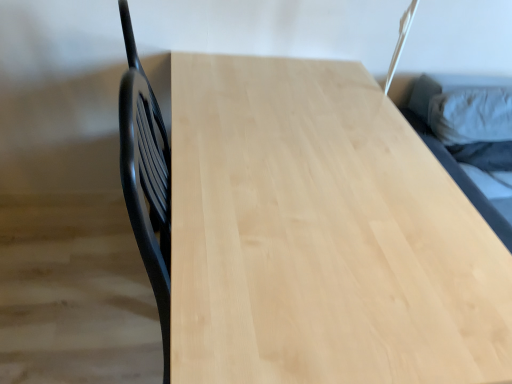
Where is `blank space situated above light wood table at center (from a real-world perspective)`? This screenshot has height=384, width=512. blank space situated above light wood table at center (from a real-world perspective) is located at coordinates (320, 169).